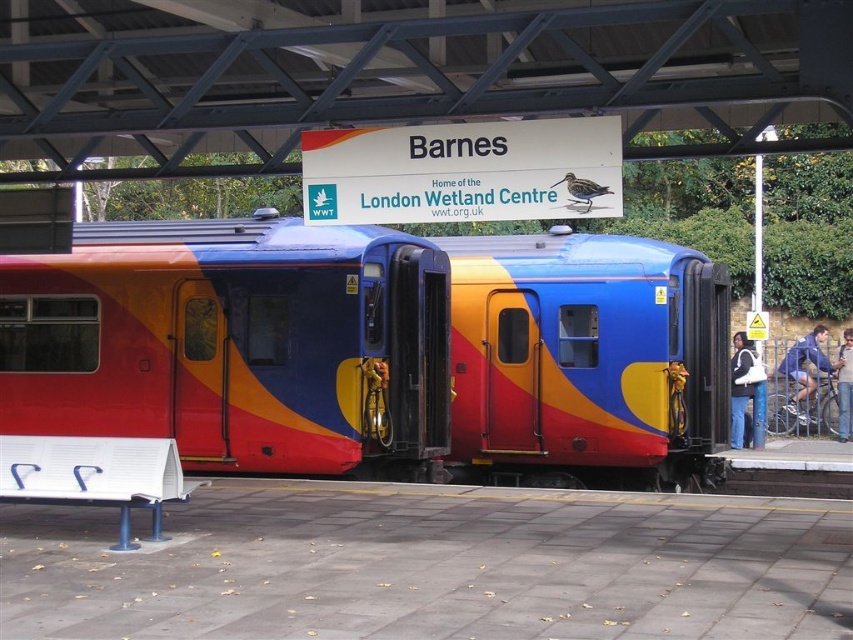
Can you confirm if matte plastic train at center is positioned above blue denim jacket at right?

Yes.

Which is behind, point (105, 392) or point (816, 368)?

The point (816, 368) is more distant.

The width and height of the screenshot is (853, 640). Identify the location of matte plastic train at center. (375, 349).

Does matte plastic train at center have a greater width compared to matte black jacket at lower right?

Yes.

Based on the photo, does matte plastic train at center come behind matte black jacket at lower right?

No, matte plastic train at center is in front of matte black jacket at lower right.

At what (x,y) coordinates should I click in order to perform the action: click on matte plastic train at center. Please return your answer as a coordinate pair (x, y). Image resolution: width=853 pixels, height=640 pixels. Looking at the image, I should click on (375, 349).

Does point (54, 276) lie behind point (848, 406)?

That is False.

Between point (355, 403) and point (840, 349), which one is positioned behind?

The point (840, 349) is more distant.

The image size is (853, 640). I want to click on matte plastic train at center, so click(x=375, y=349).